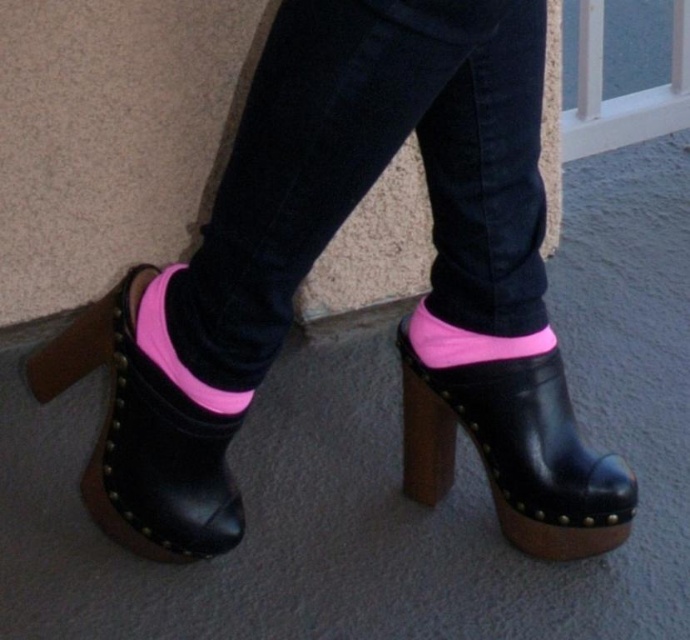
Question: Which point appears farthest from the camera in this image?

Choices:
 (A) (150, 323)
 (B) (493, 352)

Answer: (B)

Question: Which point appears closest to the camera in this image?

Choices:
 (A) (466, 256)
 (B) (217, 388)
 (C) (415, 326)
 (D) (117, 408)

Answer: (B)

Question: Can you confirm if leather high-heeled sandal at lower left is positioned above pink fabric sock at lower center?

Choices:
 (A) no
 (B) yes

Answer: (A)

Question: Does matte black clog at center appear over pink fabric sock at lower center?

Choices:
 (A) yes
 (B) no

Answer: (A)

Question: Does leather high-heeled sandal at lower left have a larger size compared to neon pink fabric sock at lower center?

Choices:
 (A) no
 (B) yes

Answer: (B)

Question: Which object is farther from the camera taking this photo?

Choices:
 (A) matte black clog at center
 (B) black leather clog at lower right

Answer: (B)